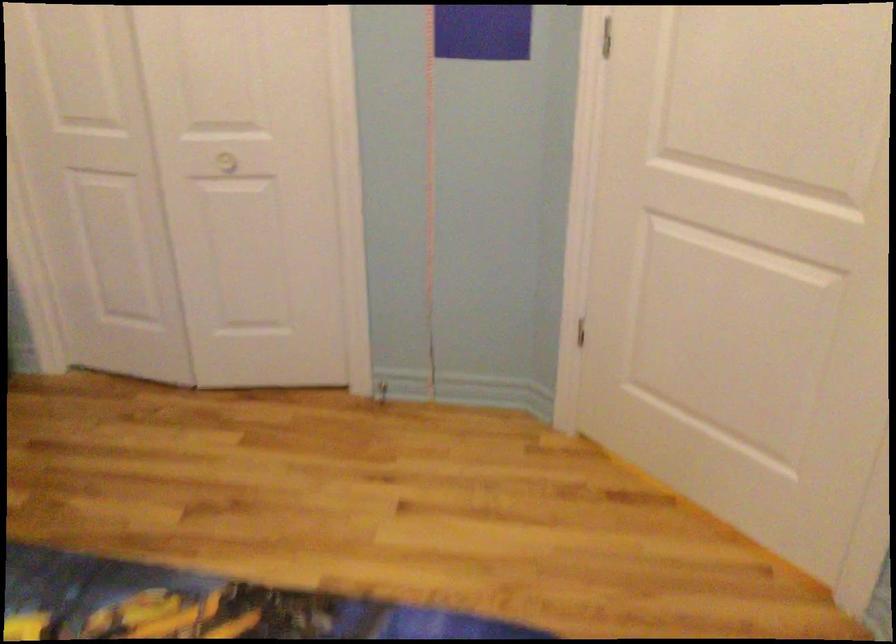
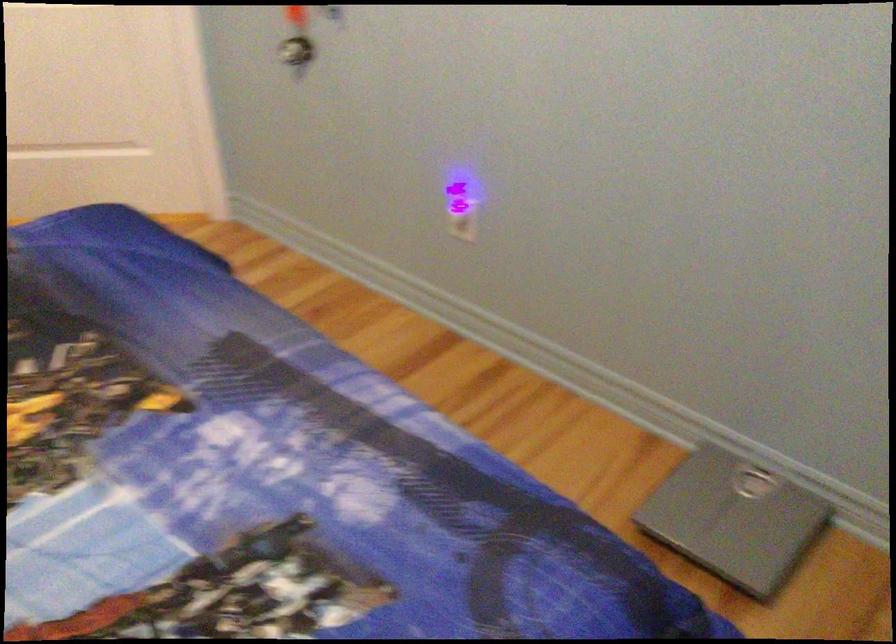
How did the camera likely rotate?

The rotation direction of the camera is right-down.